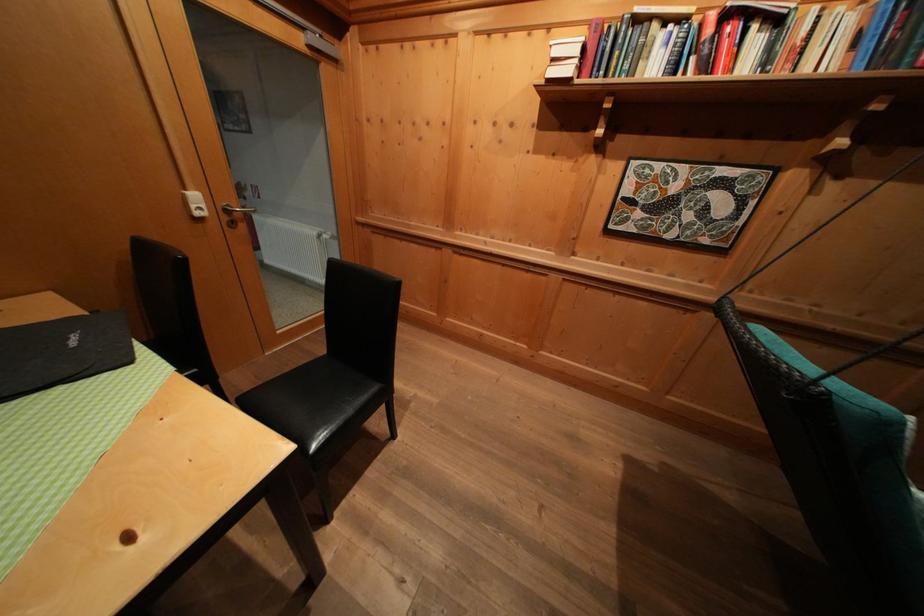
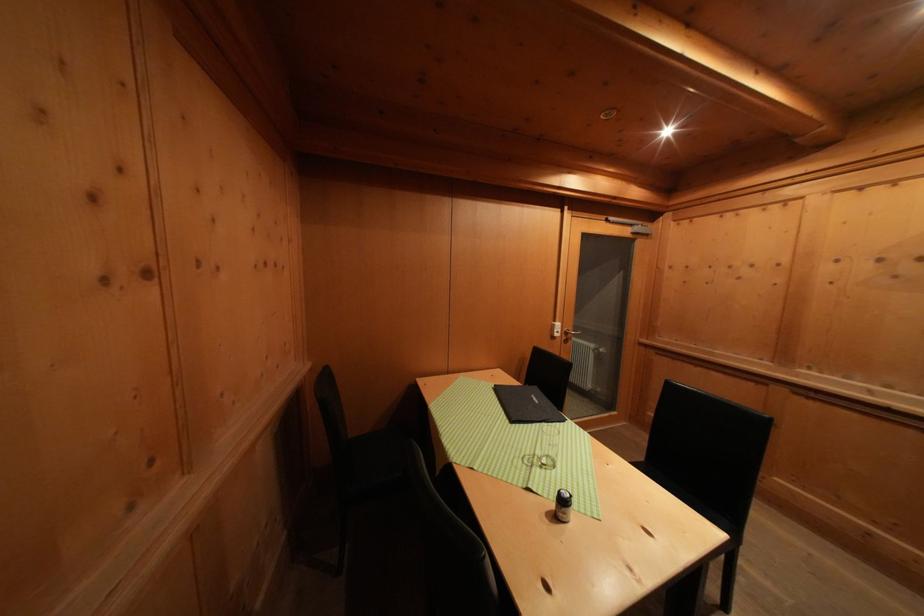
In the second image, find the point that corresponds to pixel 201 200 in the first image.

(564, 330)